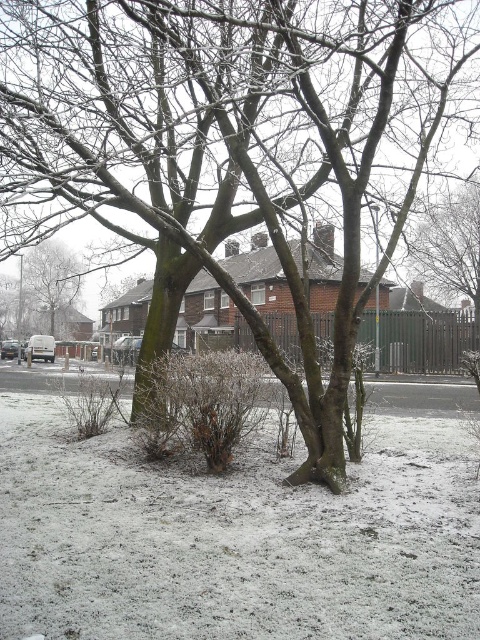
Is point (133, 397) closer to camera compared to point (92, 426)?

No, (133, 397) is further to viewer.

Which of these two, brown/dry bush at center or brown textured bush at lower left, stands shorter?

Standing shorter between the two is brown textured bush at lower left.

What do you see at coordinates (197, 404) in the screenshot? Image resolution: width=480 pixels, height=640 pixels. I see `brown/dry bush at center` at bounding box center [197, 404].

At what (x,y) coordinates should I click in order to perform the action: click on brown/dry bush at center. Please return your answer as a coordinate pair (x, y). Looking at the image, I should click on point(197,404).

Does brown/dry bush at center have a greater width compared to snow-covered branches at upper center?

No, brown/dry bush at center is not wider than snow-covered branches at upper center.

Which is more to the right, brown/dry bush at center or snow-covered branches at upper center?

snow-covered branches at upper center

Is point (179, 417) less distant than point (468, 253)?

That is True.

Where is `brown/dry bush at center`? brown/dry bush at center is located at coordinates (197, 404).

Does smooth brown tree trunk at upper left appear on the left side of brown textured bush at lower left?

Indeed, smooth brown tree trunk at upper left is positioned on the left side of brown textured bush at lower left.

Is point (36, 250) farther from viewer compared to point (110, 413)?

Yes, point (36, 250) is behind point (110, 413).

This screenshot has width=480, height=640. In order to click on smooth brown tree trunk at upper left in this screenshot , I will do `click(52, 292)`.